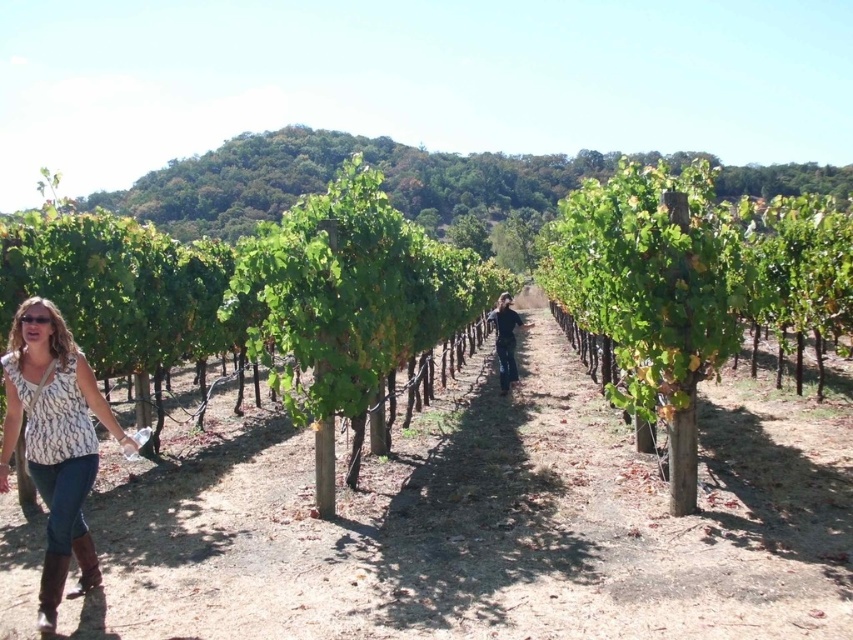
From the picture: Can you confirm if white printed blouse at lower left is taller than brown suede boot at lower left?

Yes, white printed blouse at lower left is taller than brown suede boot at lower left.

Is point (64, 369) less distant than point (62, 570)?

No, it is behind (62, 570).

This screenshot has width=853, height=640. I want to click on white printed blouse at lower left, so click(x=55, y=444).

Can you confirm if brown suede boot at lower left is positioned below brown leather boot at lower left?

Correct, brown suede boot at lower left is located below brown leather boot at lower left.

Based on the photo, is brown suede boot at lower left to the right of brown leather boot at lower left from the viewer's perspective?

Indeed, brown suede boot at lower left is positioned on the right side of brown leather boot at lower left.

Image resolution: width=853 pixels, height=640 pixels. Find the location of `brown suede boot at lower left`. brown suede boot at lower left is located at coordinates (50, 589).

Can you confirm if white printed blouse at lower left is shorter than transparent plastic goggles at lower left?

No.

Image resolution: width=853 pixels, height=640 pixels. Find the location of `white printed blouse at lower left`. white printed blouse at lower left is located at coordinates point(55,444).

Which is in front, point (86, 577) or point (30, 321)?

Point (30, 321) is in front.

I want to click on white printed blouse at lower left, so click(x=55, y=444).